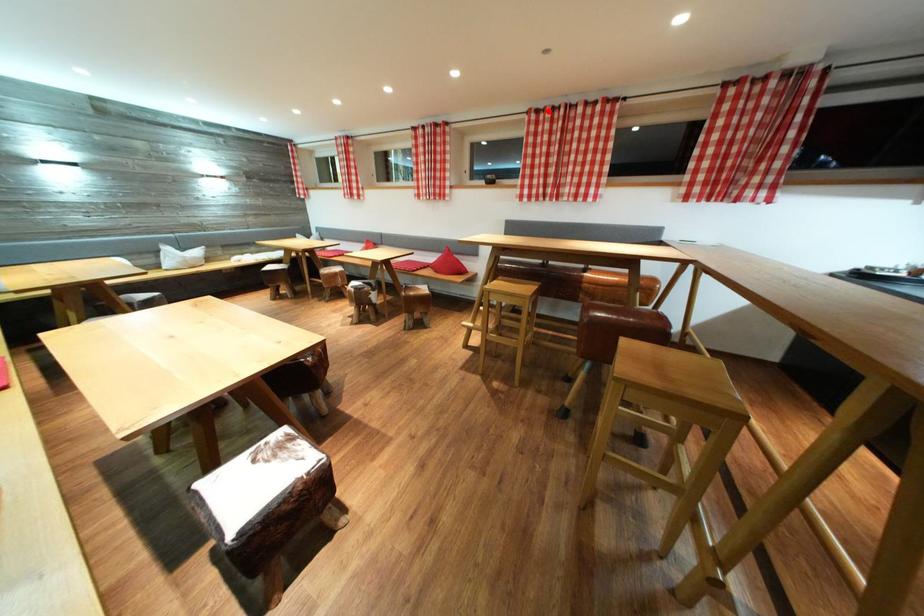
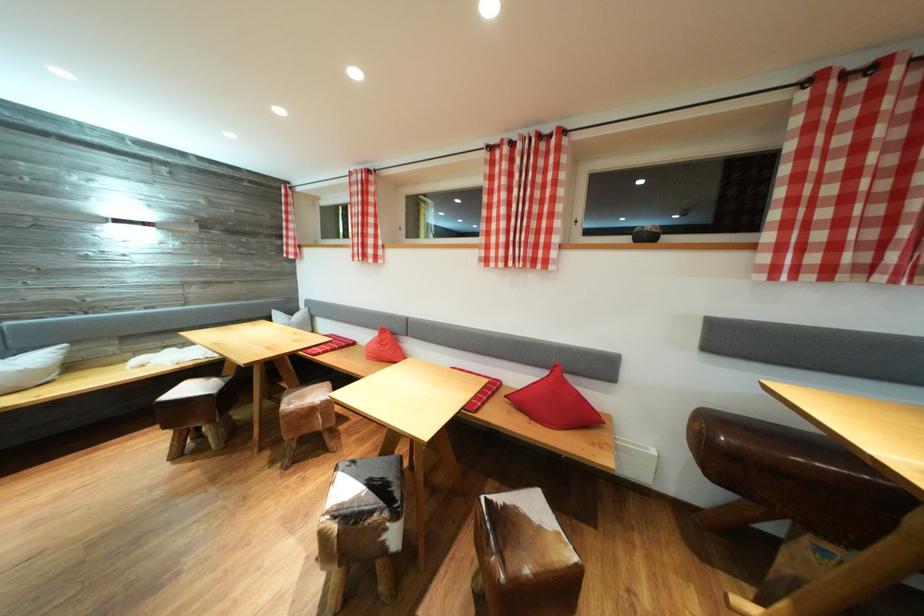
Locate, in the second image, the point that corresponds to the highlighted location in the first image.

(869, 66)